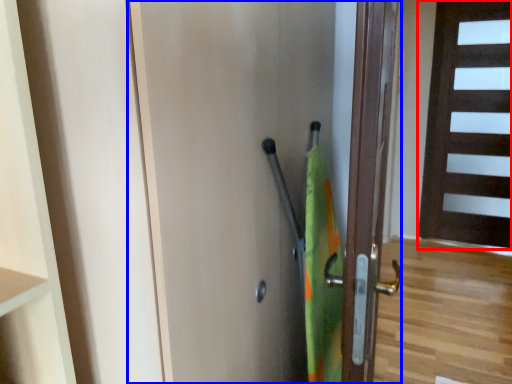
Question: Among these objects, which one is nearest to the camera, door (highlighted by a red box) or door (highlighted by a blue box)?

Choices:
 (A) door
 (B) door

Answer: (B)